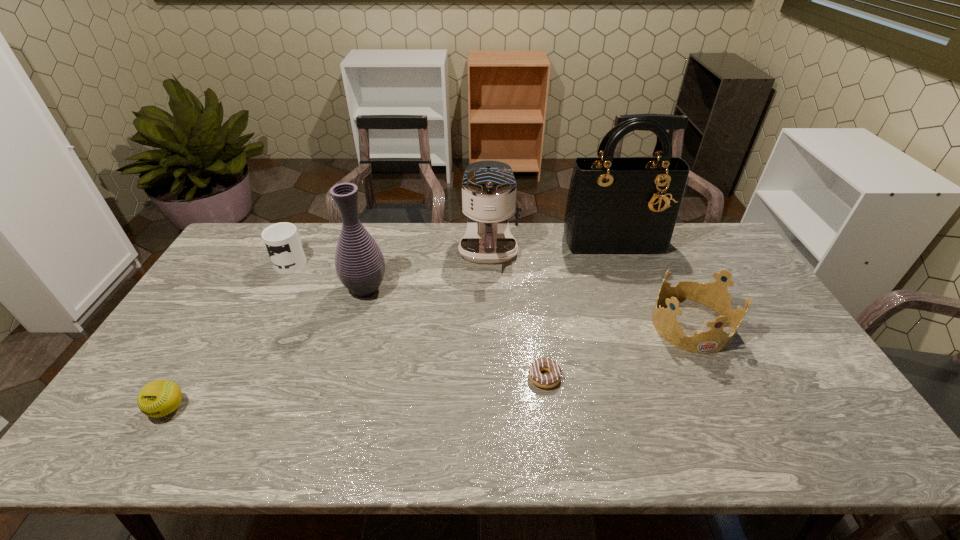
You are a GUI agent. You are given a task and a screenshot of the screen. Output one action in this format:
    pyautogui.click(x=<x>, y=<y>)
    Task: Click on the vacant region located at the front of the tallest object with visible charms
    This screenshot has height=540, width=960.
    Given the screenshot: What is the action you would take?
    pyautogui.click(x=626, y=274)

The height and width of the screenshot is (540, 960). What are the coordinates of `free space located 0.290m on the back of the third object from left to right` in the screenshot? It's located at (384, 224).

Locate an element on the screen. Image resolution: width=960 pixels, height=540 pixels. vacant space located on the front-facing side of the third tallest object is located at coordinates (x=491, y=337).

Where is `blank area located 0.110m on the front-facing side of the tiara`? blank area located 0.110m on the front-facing side of the tiara is located at coordinates (722, 388).

Locate an element on the screen. blank area located 0.080m on the handle side of the second object from left to right is located at coordinates (305, 235).

Locate an element on the screen. free space located on the handle side of the second object from left to right is located at coordinates (309, 227).

Image resolution: width=960 pixels, height=540 pixels. What are the coordinates of `free space located 0.110m on the handle side of the second object from left to right` in the screenshot? It's located at (308, 230).

The width and height of the screenshot is (960, 540). Find the location of `vacant space located on the logo side of the sixth tallest object`. vacant space located on the logo side of the sixth tallest object is located at coordinates (141, 453).

You are a GUI agent. You are given a task and a screenshot of the screen. Output one action in this format:
    pyautogui.click(x=<x>, y=<y>)
    Task: Click on the blank space located 0.090m on the back of the doughnut
    
    Given the screenshot: What is the action you would take?
    pyautogui.click(x=540, y=338)

The width and height of the screenshot is (960, 540). I want to click on handbag at the far edge, so click(623, 206).